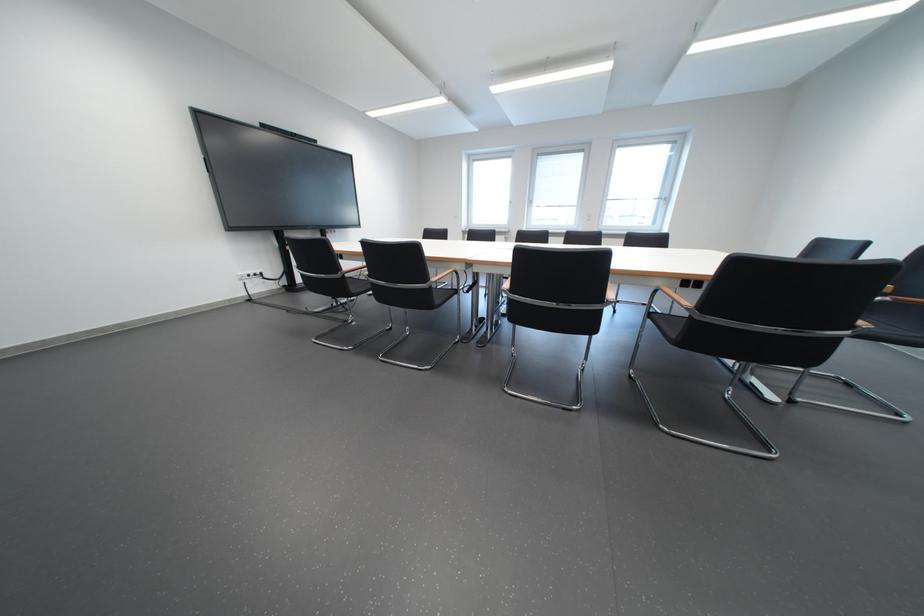
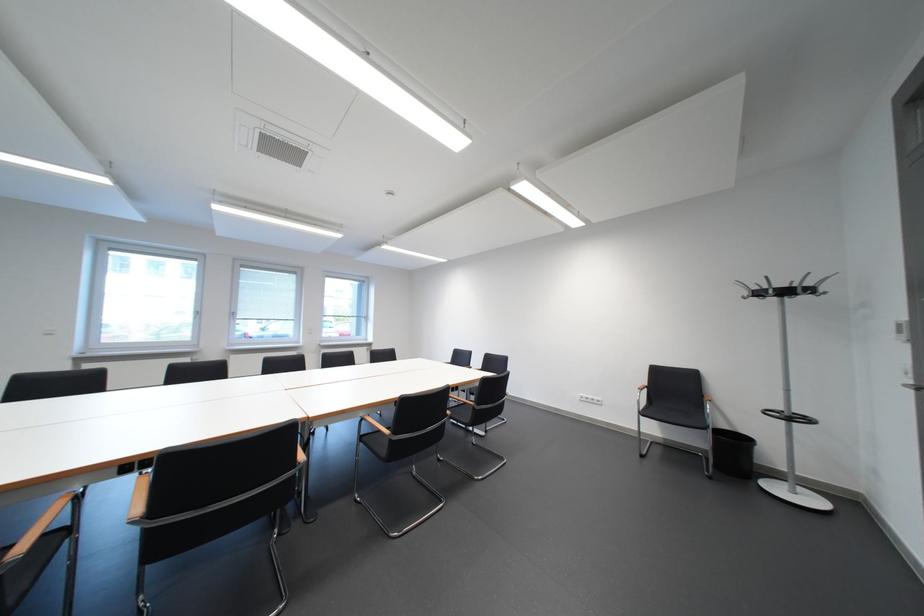
Where in the second image is the point corresponding to point 616,302 from the first image?

(459, 416)